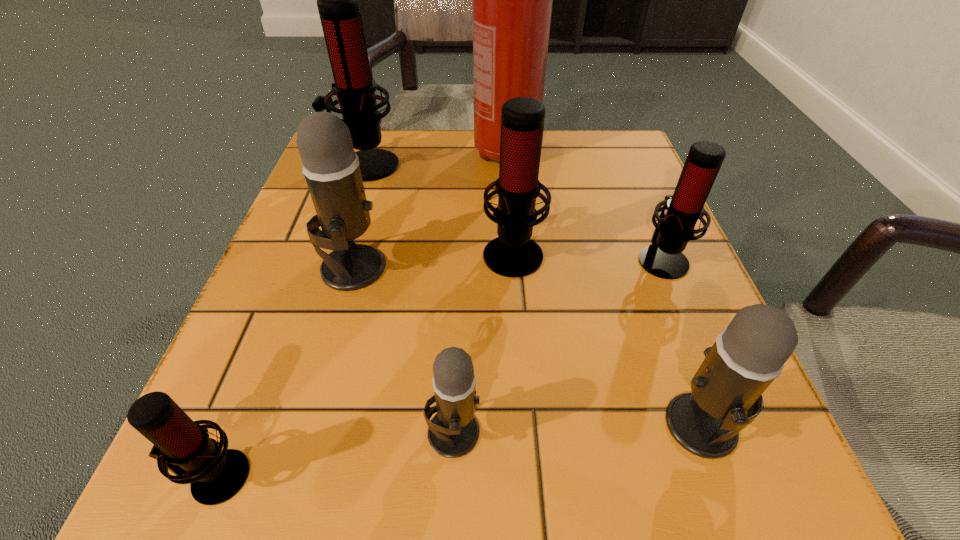
You are a GUI agent. You are given a task and a screenshot of the screen. Output one action in this format:
    pyautogui.click(x=<x>, y=<y>)
    Task: Click on the vacant space positioned 0.200m on the back of the smallest red microphone
    The height and width of the screenshot is (540, 960).
    Given the screenshot: What is the action you would take?
    pyautogui.click(x=279, y=319)

Locate an element on the screen. fire extinguisher located at the far edge is located at coordinates (512, 0).

You are a GUI agent. You are given a task and a screenshot of the screen. Output one action in this format:
    pyautogui.click(x=<x>, y=<y>)
    Task: Click on the microphone at the far edge
    This screenshot has width=960, height=540.
    Given the screenshot: What is the action you would take?
    point(337,0)

Where is `object located in the far left corner section of the desktop`? The height and width of the screenshot is (540, 960). object located in the far left corner section of the desktop is located at coordinates (337, 0).

Locate an element on the screen. This screenshot has width=960, height=540. object present at the near left corner is located at coordinates (181, 445).

Find the location of a particular element. object situated at the near right corner is located at coordinates (725, 397).

Where is `free space at the far edge`? free space at the far edge is located at coordinates (554, 177).

In the image, there is a desktop. At what (x,y) coordinates should I click in order to perform the action: click on vacant space at the near edge. Please return your answer as a coordinate pair (x, y). This screenshot has height=540, width=960. Looking at the image, I should click on [x=478, y=492].

At what (x,y) coordinates should I click in order to perform the action: click on vacant region at the left edge of the desktop. Please return your answer as a coordinate pair (x, y). Looking at the image, I should click on (324, 318).

In the image, there is a desktop. Find the location of `vacant space at the right edge`. vacant space at the right edge is located at coordinates (595, 249).